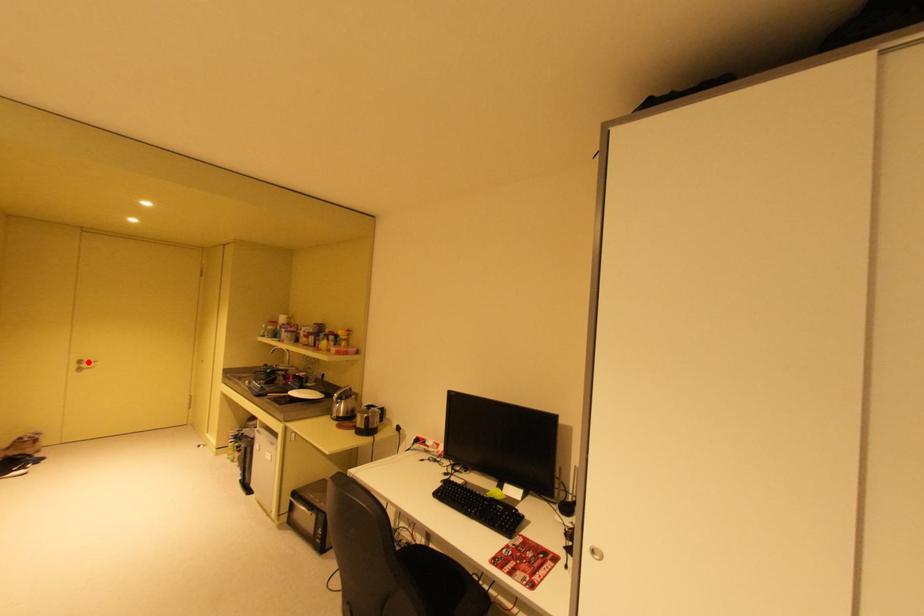
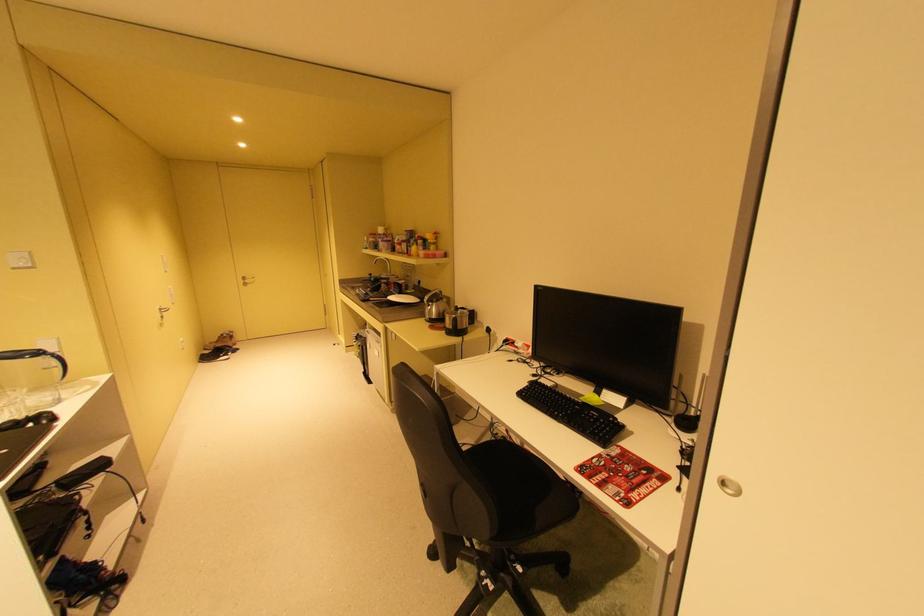
In the second image, find the point that corresponds to the highlighted location in the first image.

(252, 278)